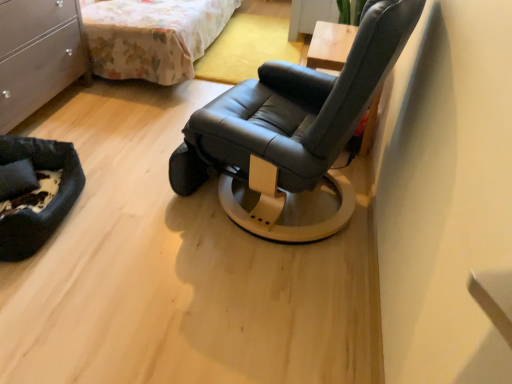
Locate an element on the screen. The height and width of the screenshot is (384, 512). vacant space to the left of black leather chair at center is located at coordinates (121, 177).